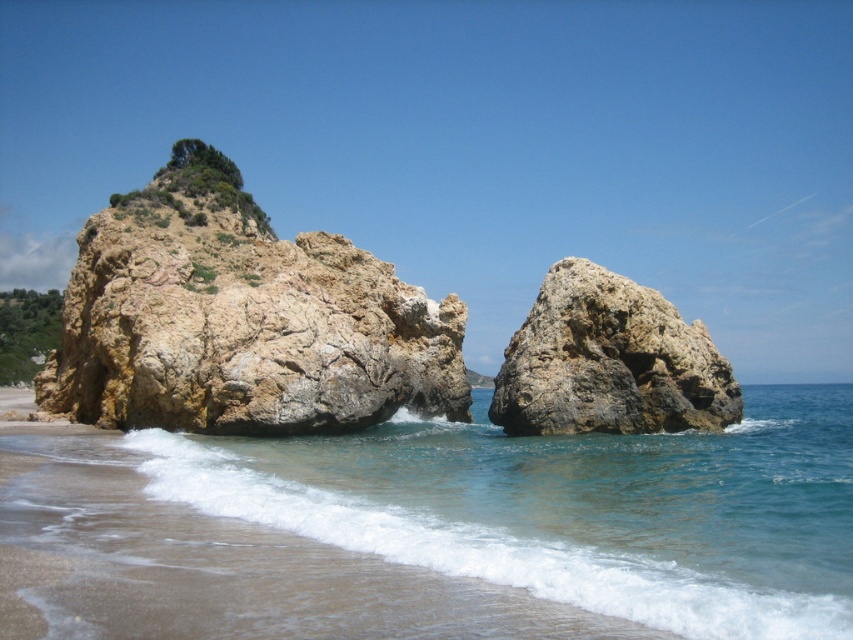
You are a marine biologist studying the coastal ecosystem. You notice the clear blue water at lower left and the rusty brown rock at center. Which object is closer to the observer standing on the beach?

The clear blue water at lower left is closer to the observer because it is in front of the rusty brown rock at center.

You are standing on the beach looking at the coastal scene. There is a point marked at coordinates point (570, 508). What object in the scene is located at this point?

The clear blue water at lower left is located at point (570, 508).